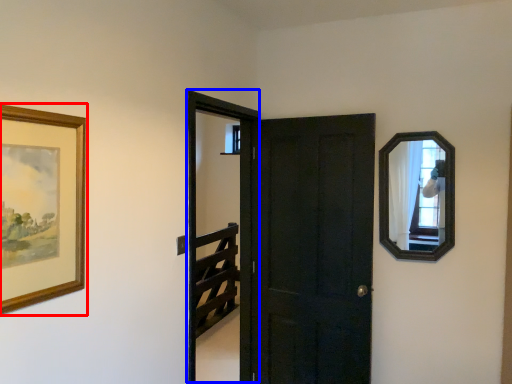
Question: Which point is further to the camera, picture frame (highlighted by a red box) or screen door (highlighted by a blue box)?

Choices:
 (A) picture frame
 (B) screen door

Answer: (B)